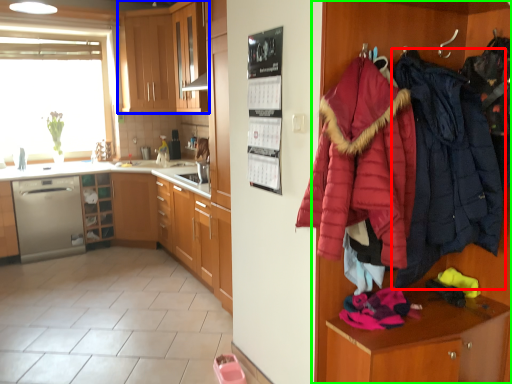
Question: Which object is the closest to the jacket (highlighted by a red box)? Choose among these: cabinetry (highlighted by a blue box) or dresser (highlighted by a green box).

Choices:
 (A) cabinetry
 (B) dresser

Answer: (B)